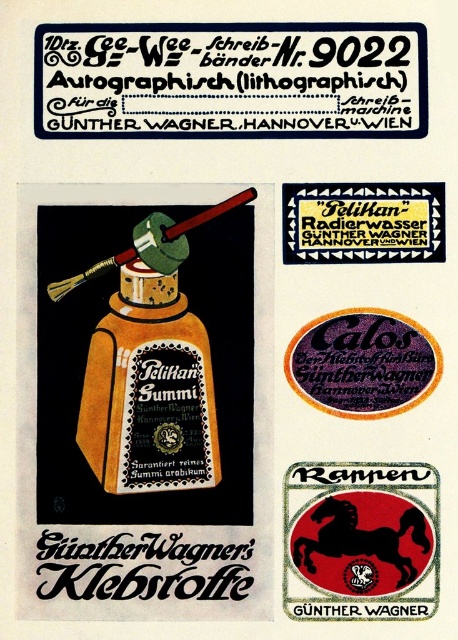
Based on the photo, does matte gold bottle at center have a larger size compared to black paper sticker at upper center?

Yes, matte gold bottle at center is bigger than black paper sticker at upper center.

Is point (109, 490) in front of point (321, 200)?

Yes, it is in front of point (321, 200).

The image size is (458, 640). I want to click on matte gold bottle at center, so click(x=148, y=390).

Locate an element on the screen. matte gold bottle at center is located at coordinates (148, 390).

Which is below, black rubber horse at lower right or black paper sticker at upper center?

black rubber horse at lower right

Is point (339, 522) behind point (392, 202)?

No.

Does point (399, 476) come in front of point (372, 221)?

Yes, it is.

Identify the location of black rubber horse at lower right. The image size is (458, 640). (360, 541).

Is matte gold bottle at center bigger than black rubber horse at lower right?

Correct, matte gold bottle at center is larger in size than black rubber horse at lower right.

Which is behind, point (108, 401) or point (299, 550)?

The point (108, 401) is more distant.

Between point (124, 465) and point (380, 502), which one is positioned behind?

Positioned behind is point (380, 502).

Where is `matte gold bottle at center`? The image size is (458, 640). matte gold bottle at center is located at coordinates (148, 390).